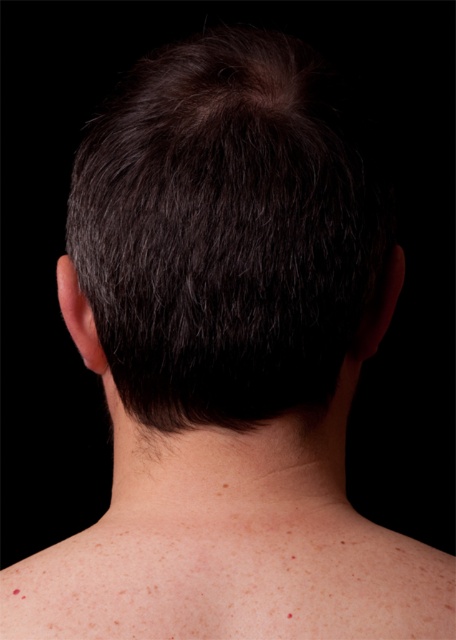
Question: Which point appears farthest from the camera in this image?

Choices:
 (A) [x=177, y=380]
 (B) [x=234, y=496]

Answer: (B)

Question: Can you confirm if dark brown hair at center is wider than skinsmoothneck at center?

Choices:
 (A) yes
 (B) no

Answer: (A)

Question: Can you confirm if dark brown hair at center is positioned to the right of skinsmoothneck at center?

Choices:
 (A) no
 (B) yes

Answer: (A)

Question: Is dark brown hair at center smaller than skinsmoothneck at center?

Choices:
 (A) no
 (B) yes

Answer: (A)